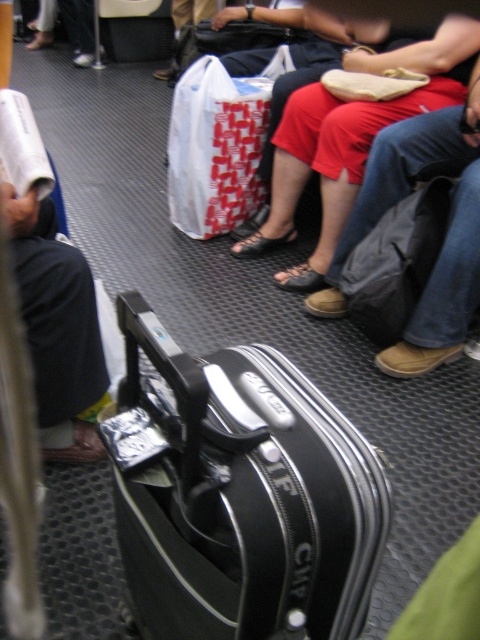
Question: Which object is positioned closest to the black hard shell suitcase at center?

Choices:
 (A) black hard suitcase at center
 (B) dark gray fabric backpack at right

Answer: (B)

Question: Is the position of white paper bag at center more distant than that of black hard suitcase at center?

Choices:
 (A) yes
 (B) no

Answer: (B)

Question: Which of these objects is positioned closest to the black hard suitcase at center?

Choices:
 (A) black hard shell suitcase at center
 (B) dark gray fabric backpack at right

Answer: (B)

Question: Is dark gray fabric backpack at right closer to the viewer compared to black hard suitcase at center?

Choices:
 (A) yes
 (B) no

Answer: (A)

Question: Which object is farther from the camera taking this photo?

Choices:
 (A) black hard shell suitcase at center
 (B) white paper bag at center

Answer: (B)

Question: Can you confirm if black hard shell suitcase at center is wider than black hard suitcase at center?

Choices:
 (A) yes
 (B) no

Answer: (B)